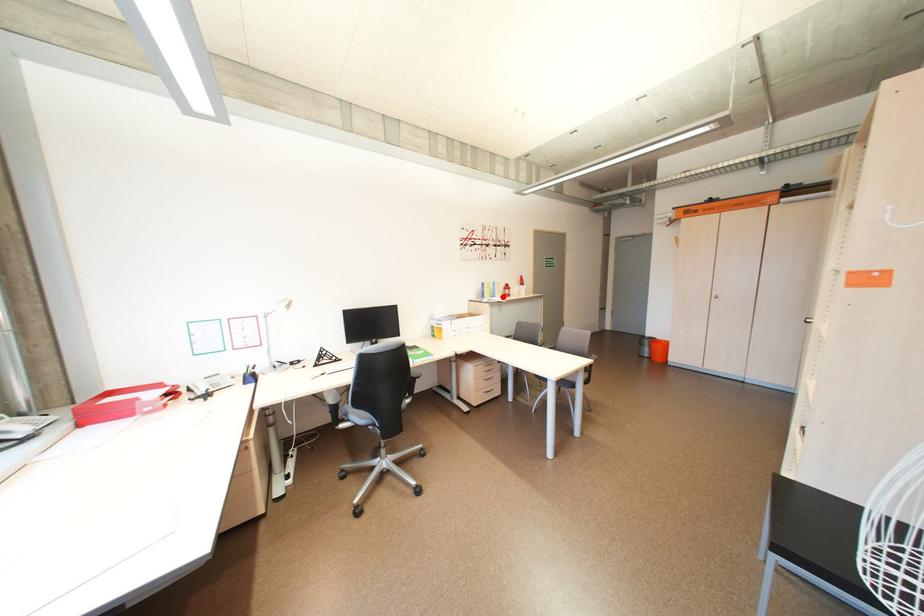
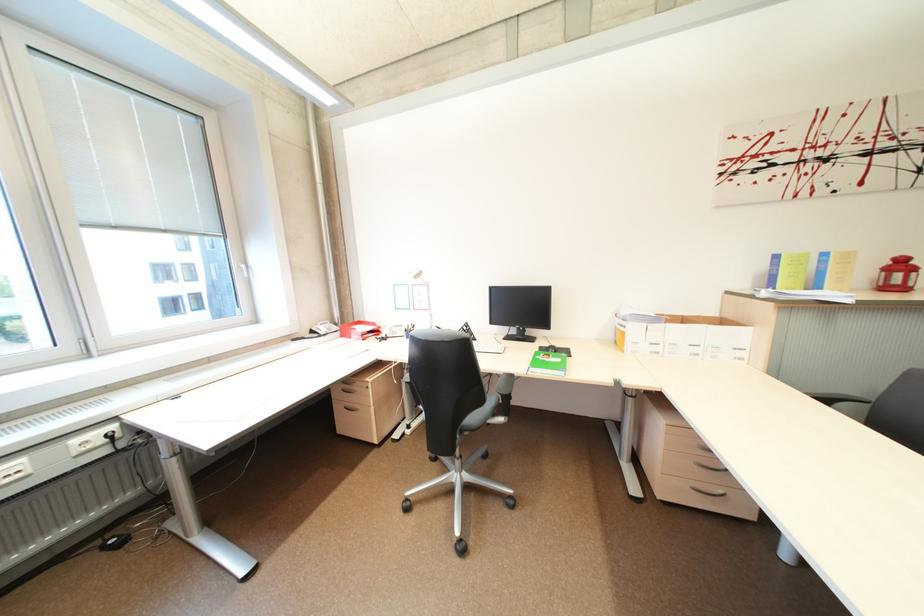
In the second image, find the point that corresponds to the highlighted location in the first image.

(825, 286)